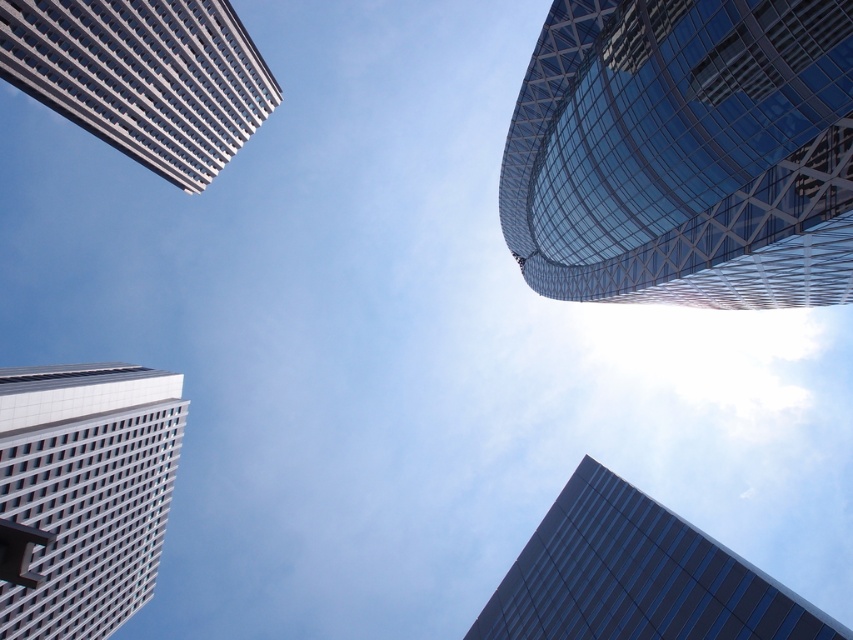
Is point (734, 200) less distant than point (77, 614)?

Yes, it is in front of point (77, 614).

Does transparent glass building at upper right appear on the right side of white grid-patterned building at lower left?

Yes, transparent glass building at upper right is to the right of white grid-patterned building at lower left.

Is point (772, 216) positioned before point (97, 540)?

Yes, it is in front of point (97, 540).

Find the location of a particular element. Image resolution: width=853 pixels, height=640 pixels. transparent glass building at upper right is located at coordinates (685, 154).

Which is below, white grid-patterned building at lower left or dark blue glass building at lower right?

dark blue glass building at lower right

Is white grid-patterned building at lower left closer to camera compared to dark blue glass building at lower right?

Yes, it is.

What do you see at coordinates (82, 493) in the screenshot? The image size is (853, 640). I see `white grid-patterned building at lower left` at bounding box center [82, 493].

This screenshot has height=640, width=853. I want to click on white grid-patterned building at lower left, so click(82, 493).

Is white glass building at upper left bigger than dark blue glass building at lower right?

Correct, white glass building at upper left is larger in size than dark blue glass building at lower right.

Is white glass building at upper left shorter than dark blue glass building at lower right?

Incorrect, white glass building at upper left's height does not fall short of dark blue glass building at lower right's.

Is point (207, 108) in front of point (595, 580)?

No, (207, 108) is further to viewer.

Image resolution: width=853 pixels, height=640 pixels. I want to click on white glass building at upper left, so click(x=143, y=76).